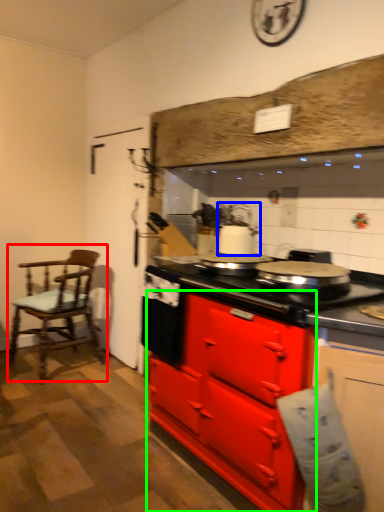
Question: Which is nearer to the chair (highlighted by a red box)? kitchen appliance (highlighted by a blue box) or cabinetry (highlighted by a green box).

Choices:
 (A) kitchen appliance
 (B) cabinetry

Answer: (A)